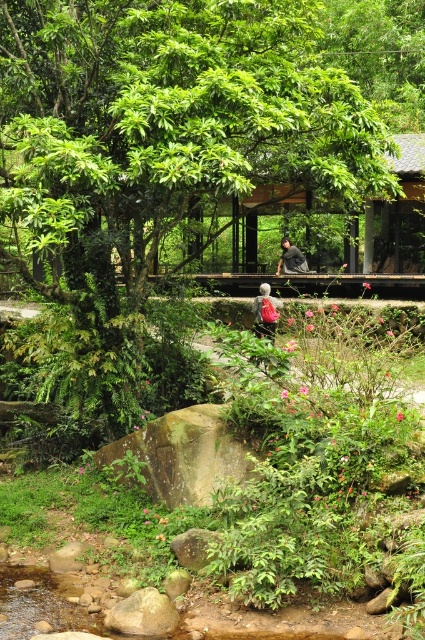
Find the location of a particular element. green leafy bush at center is located at coordinates (283, 476).

Find the location of a particular element. The height and width of the screenshot is (640, 425). green leafy bush at center is located at coordinates (283, 476).

Where is `green leafy tree at center`? The width and height of the screenshot is (425, 640). green leafy tree at center is located at coordinates (164, 131).

Is point (350, 134) less distant than point (266, 308)?

Yes, point (350, 134) is in front of point (266, 308).

At what (x,y) coordinates should I click in order to perform the action: click on green leafy tree at center. Please return your answer as a coordinate pair (x, y). Looking at the image, I should click on (164, 131).

Measure the distance from green leafy tree at center to dark gray fabric jacket at center.

A distance of 9.65 meters exists between green leafy tree at center and dark gray fabric jacket at center.

The image size is (425, 640). Identify the location of green leafy tree at center. (164, 131).

Measure the distance between green leafy tree at center and camera.

A distance of 6.69 meters exists between green leafy tree at center and camera.

In order to click on green leafy tree at center in this screenshot , I will do `click(164, 131)`.